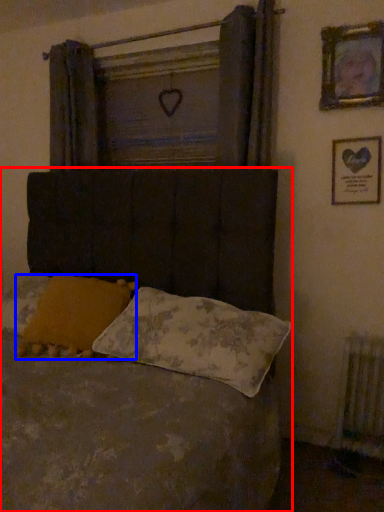
Question: Which of the following is the farthest to the observer, bed (highlighted by a red box) or pillow (highlighted by a blue box)?

Choices:
 (A) bed
 (B) pillow

Answer: (B)